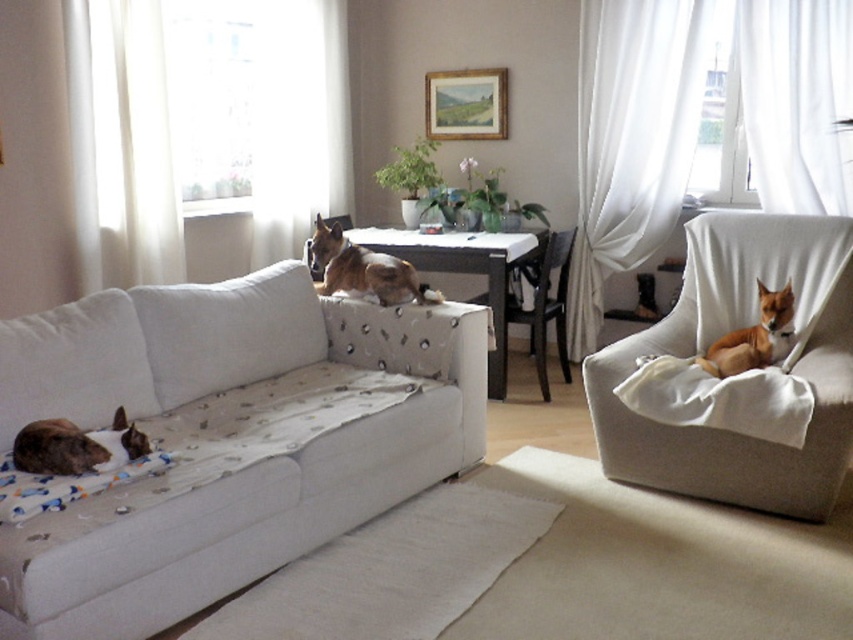
You are a visitor entering the living room and want to sit down on either the white fabric couch at lower left or the white fabric pillow at center. Which one is closer to you?

The white fabric couch at lower left is closer to you than the white fabric pillow at center.

You are standing at the entrance of the living room. The white fabric couch at lower left is located at point (223, 440). Where is the white fabric couch at lower left in the room?

The white fabric couch at lower left is located at point (223, 440) in the room.

You are planning to place a new decorative item in the living room. The item is the same size as the white fabric pillow at center. Where can you place it so that it doesn not block the view from the white fabric couch at lower left?

Since the white fabric couch at lower left is larger than the white fabric pillow at center, placing the new decorative item on the coffee table in front of the couch or on a side table to the side would ensure it doesn not obstruct the view from the couch.